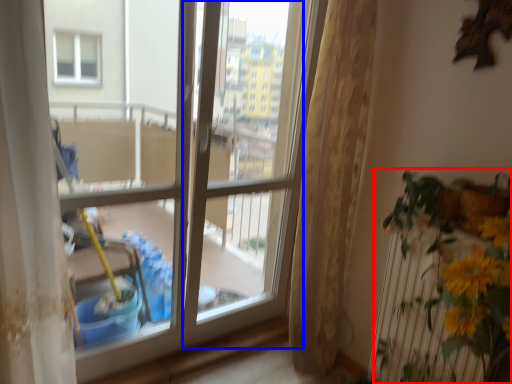
Question: Which point is closer to the camera, houseplant (highlighted by a red box) or screen door (highlighted by a blue box)?

Choices:
 (A) houseplant
 (B) screen door

Answer: (A)